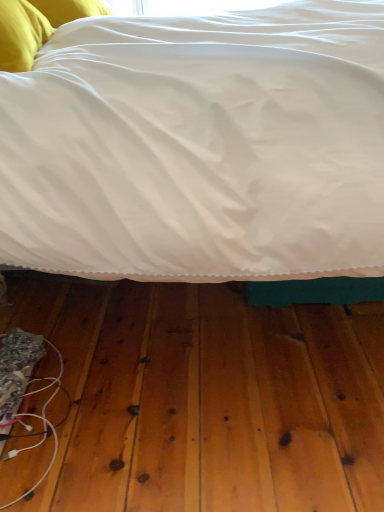
Question: Is white fabric wire at lower left completely or partially inside yellow fabric pillow at upper left?

Choices:
 (A) yes
 (B) no

Answer: (B)

Question: From the image's perspective, is yellow fabric pillow at upper left above white fabric wire at lower left?

Choices:
 (A) no
 (B) yes

Answer: (B)

Question: Does yellow fabric pillow at upper left appear on the left side of white fabric wire at lower left?

Choices:
 (A) no
 (B) yes

Answer: (B)

Question: Considering the relative sizes of yellow fabric pillow at upper left and white fabric wire at lower left in the image provided, is yellow fabric pillow at upper left smaller than white fabric wire at lower left?

Choices:
 (A) no
 (B) yes

Answer: (A)

Question: Does yellow fabric pillow at upper left have a lesser width compared to white fabric wire at lower left?

Choices:
 (A) no
 (B) yes

Answer: (A)

Question: Considering the relative positions of yellow fabric pillow at upper left and white fabric wire at lower left in the image provided, is yellow fabric pillow at upper left to the right of white fabric wire at lower left from the viewer's perspective?

Choices:
 (A) yes
 (B) no

Answer: (B)

Question: Would you say white satin bed at center is part of white fabric wire at lower left's contents?

Choices:
 (A) yes
 (B) no

Answer: (B)

Question: Is white fabric wire at lower left thinner than white satin bed at center?

Choices:
 (A) no
 (B) yes

Answer: (B)

Question: Does white fabric wire at lower left lie behind white satin bed at center?

Choices:
 (A) yes
 (B) no

Answer: (A)

Question: Does white fabric wire at lower left have a greater width compared to white satin bed at center?

Choices:
 (A) no
 (B) yes

Answer: (A)

Question: Is white satin bed at center at the back of white fabric wire at lower left?

Choices:
 (A) yes
 (B) no

Answer: (A)

Question: Is white fabric wire at lower left at the right side of white satin bed at center?

Choices:
 (A) yes
 (B) no

Answer: (B)

Question: Is white satin bed at center next to yellow fabric pillow at upper left?

Choices:
 (A) no
 (B) yes

Answer: (A)